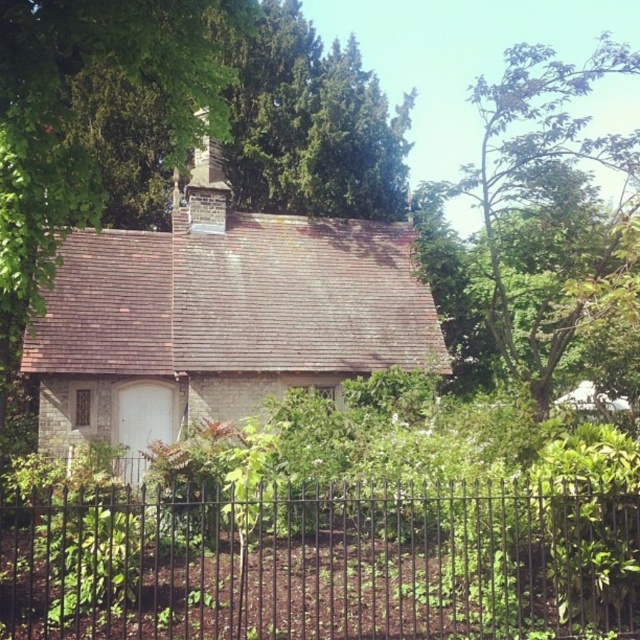
You are standing in front of the house and want to plant a new flower bed. The black wrought iron fence at lower center and the green leafy tree at upper right are in your way. Which object is closer to you that you need to consider first when planning the flower bed location?

The black wrought iron fence at lower center is closer to you than the green leafy tree at upper right, so you should consider its position first when planning the flower bed location.